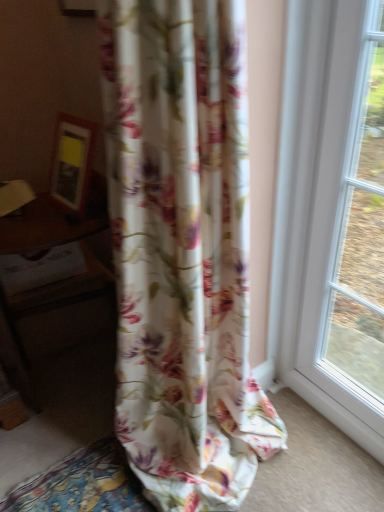
Question: Is floral fabric curtain at center taller than wooden table at left?

Choices:
 (A) yes
 (B) no

Answer: (A)

Question: Is floral fabric curtain at center positioned behind wooden table at left?

Choices:
 (A) yes
 (B) no

Answer: (B)

Question: Is floral fabric curtain at center to the right of wooden table at left from the viewer's perspective?

Choices:
 (A) yes
 (B) no

Answer: (A)

Question: Does floral fabric curtain at center have a larger size compared to wooden table at left?

Choices:
 (A) no
 (B) yes

Answer: (B)

Question: Is floral fabric curtain at center in front of wooden table at left?

Choices:
 (A) yes
 (B) no

Answer: (A)

Question: From the image's perspective, is floral fabric curtain at center on wooden table at left?

Choices:
 (A) no
 (B) yes

Answer: (B)

Question: Is wooden table at left bigger than floral fabric curtain at center?

Choices:
 (A) no
 (B) yes

Answer: (A)

Question: Is floral fabric curtain at center at the back of wooden table at left?

Choices:
 (A) no
 (B) yes

Answer: (A)

Question: From the image's perspective, is wooden table at left beneath floral fabric curtain at center?

Choices:
 (A) yes
 (B) no

Answer: (A)

Question: Can you confirm if wooden table at left is shorter than floral fabric curtain at center?

Choices:
 (A) no
 (B) yes

Answer: (B)

Question: Is wooden table at left oriented towards floral fabric curtain at center?

Choices:
 (A) yes
 (B) no

Answer: (A)

Question: Can you confirm if wooden table at left is positioned to the left of floral fabric curtain at center?

Choices:
 (A) yes
 (B) no

Answer: (A)

Question: From a real-world perspective, is wooden table at left above or below floral fabric curtain at center?

Choices:
 (A) above
 (B) below

Answer: (B)